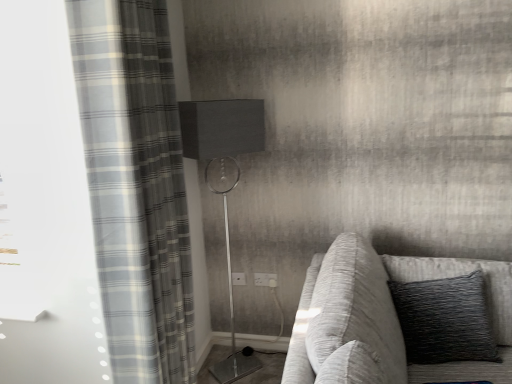
Question: Is point (262, 279) closer or farther from the camera than point (131, 284)?

Choices:
 (A) closer
 (B) farther

Answer: (B)

Question: From the image's perspective, is white plastic electric outlet at center, the second electric outlet when ordered from left to right, above or below gray plaid curtain at left?

Choices:
 (A) above
 (B) below

Answer: (B)

Question: Based on their relative distances, which object is farther from the white plastic electric outlet at center, arranged as the second electric outlet when viewed from the right?

Choices:
 (A) white plastic electric outlet at center, the first electric outlet from the right
 (B) black textured pillow at right
 (C) metallic silver table lamp at center
 (D) textured gray fabric couch at right
 (E) gray plaid curtain at left

Answer: (B)

Question: Which object is positioned closest to the gray plaid curtain at left?

Choices:
 (A) black textured pillow at right
 (B) textured gray fabric couch at right
 (C) white plastic electric outlet at center, the first electric outlet from the right
 (D) metallic silver table lamp at center
 (E) white plastic electric outlet at center, arranged as the second electric outlet when viewed from the right

Answer: (B)